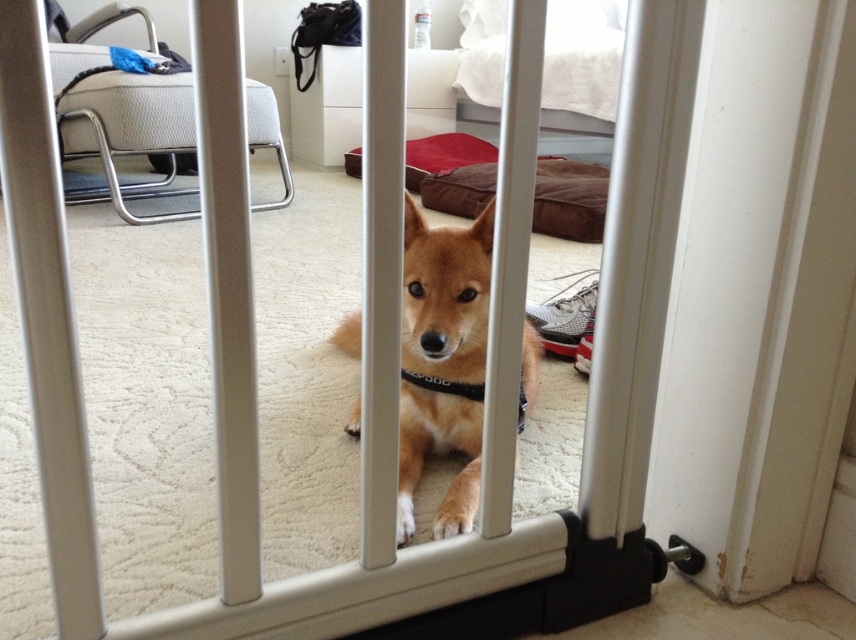
Question: Can you confirm if golden fur dog at center is smaller than brown plush dog bed at center?

Choices:
 (A) yes
 (B) no

Answer: (A)

Question: Which object is farther from the camera taking this photo?

Choices:
 (A) black fabric neckband at center
 (B) brown plush dog bed at center

Answer: (B)

Question: Does brown plush dog bed at center appear on the right side of black fabric neckband at center?

Choices:
 (A) yes
 (B) no

Answer: (A)

Question: Can you confirm if brown plush dog bed at center is thinner than black fabric neckband at center?

Choices:
 (A) yes
 (B) no

Answer: (B)

Question: Considering the real-world distances, which object is farthest from the black fabric neckband at center?

Choices:
 (A) brown plush dog bed at center
 (B) golden fur dog at center

Answer: (A)

Question: Which of these objects is positioned closest to the brown plush dog bed at center?

Choices:
 (A) golden fur dog at center
 (B) black fabric neckband at center

Answer: (A)